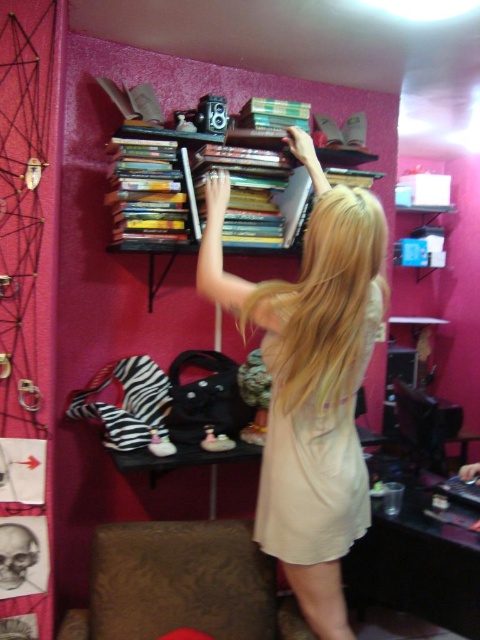
Between matte beige dress at center and brown textured couch at lower left, which one is positioned lower?

brown textured couch at lower left is lower down.

Does point (297, 372) come closer to viewer compared to point (240, 584)?

Yes.

Image resolution: width=480 pixels, height=640 pixels. Find the location of `matte beige dress at center`. matte beige dress at center is located at coordinates (311, 380).

From the picture: Can you confirm if brown textured couch at lower left is shorter than beige cotton dress at upper center?

Correct, brown textured couch at lower left is not as tall as beige cotton dress at upper center.

In the scene shown: Is brown textured couch at lower left bigger than beige cotton dress at upper center?

Actually, brown textured couch at lower left might be smaller than beige cotton dress at upper center.

Image resolution: width=480 pixels, height=640 pixels. In order to click on brown textured couch at lower left in this screenshot , I will do `click(182, 584)`.

Does matte beige dress at center have a smaller size compared to beige cotton dress at upper center?

No, matte beige dress at center is not smaller than beige cotton dress at upper center.

Is matte beige dress at center shorter than beige cotton dress at upper center?

No.

Between point (298, 557) and point (360, 384), which one is positioned in front?

Point (298, 557)

In order to click on matte beige dress at center in this screenshot , I will do `click(311, 380)`.